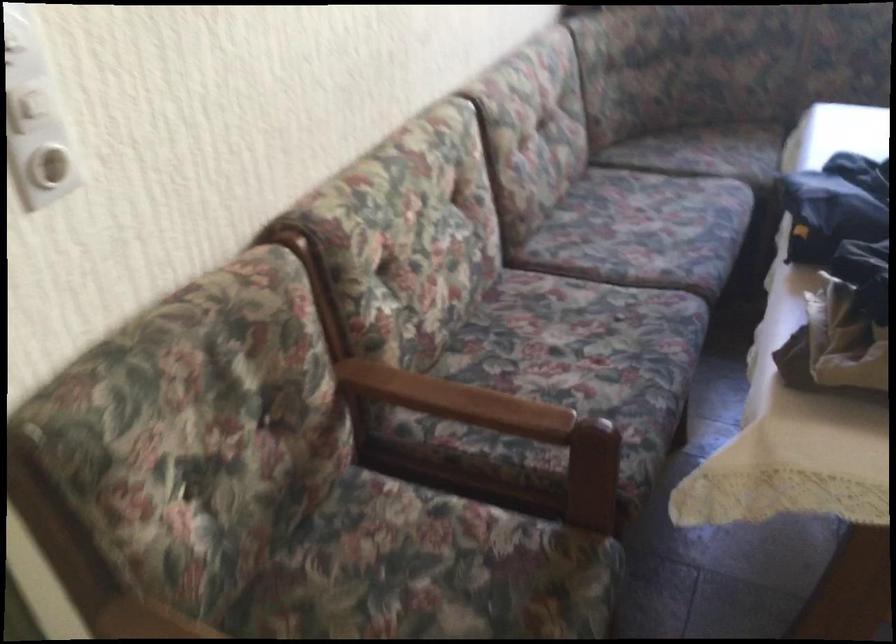
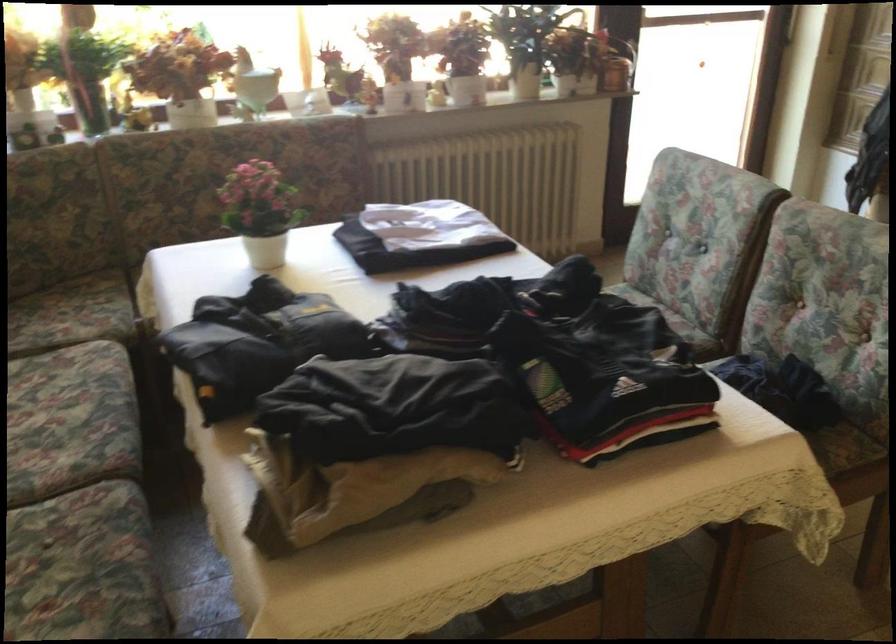
Find the pixel in the second image that matches pixel 616 343 in the first image.

(83, 567)